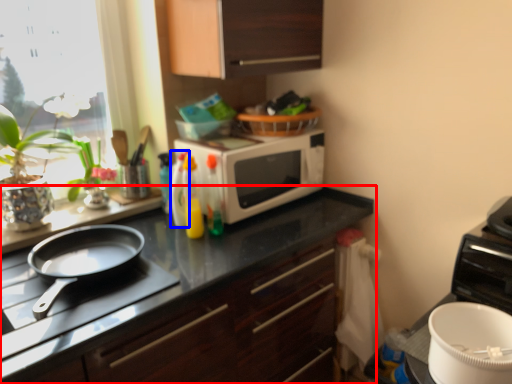
Question: Which object is closer to the camera taking this photo, cabinetry (highlighted by a red box) or bottle (highlighted by a blue box)?

Choices:
 (A) cabinetry
 (B) bottle

Answer: (A)